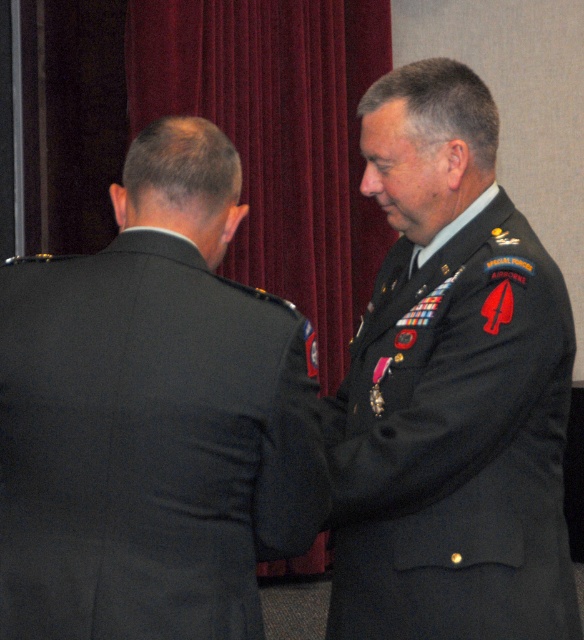
Who is positioned more to the right, dark green fabric military uniform at right or velvet red curtain at upper center?

From the viewer's perspective, dark green fabric military uniform at right appears more on the right side.

Looking at this image, could you measure the distance between dark green fabric military uniform at right and velvet red curtain at upper center?

dark green fabric military uniform at right and velvet red curtain at upper center are 2.65 meters apart.

The height and width of the screenshot is (640, 584). I want to click on dark green fabric military uniform at right, so click(456, 444).

Can you confirm if black fabric suit at back is bigger than velvet red curtain at upper center?

No, black fabric suit at back is not bigger than velvet red curtain at upper center.

Find the location of a particular element. This screenshot has width=584, height=640. black fabric suit at back is located at coordinates (152, 417).

This screenshot has width=584, height=640. What are the coordinates of `black fabric suit at back` in the screenshot? It's located at (152, 417).

This screenshot has height=640, width=584. Identify the location of black fabric suit at back. (152, 417).

Does black fabric suit at back appear over dark green fabric military uniform at right?

Yes.

Who is taller, black fabric suit at back or dark green fabric military uniform at right?

Standing taller between the two is dark green fabric military uniform at right.

Between point (276, 412) and point (384, 397), which one is positioned in front?

Point (276, 412) is in front.

I want to click on black fabric suit at back, so click(152, 417).